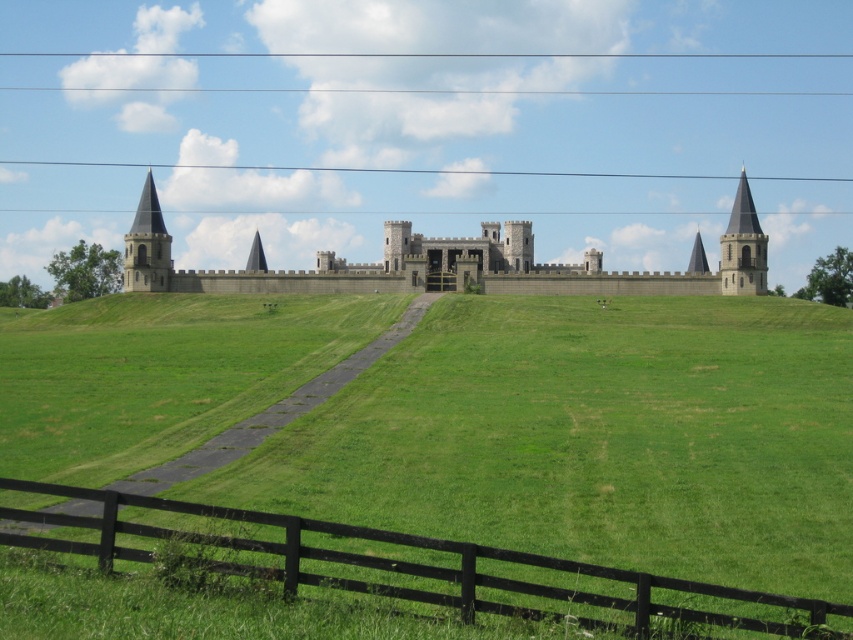
You are a visitor approaching the castle through the paved pathway. You notice a point marked at coordinates (409, 568). What object is located at this point?

The point at coordinates (409, 568) marks the location of the black wooden fence at lower center.

You are standing at the base of the castle hill and see two points marked in the scene. Which point, point (549, 298) or point (135, 220), is closer to you?

Point (549, 298) is closer to the viewer than point (135, 220).